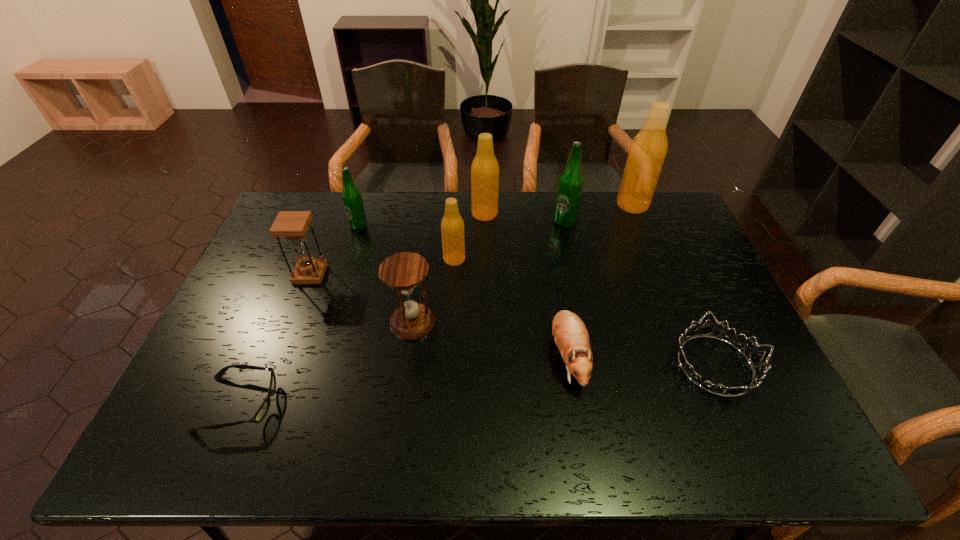
Find the location of a particular element. The width and height of the screenshot is (960, 540). vacant space at the far left corner is located at coordinates pos(306,199).

This screenshot has width=960, height=540. Identify the location of free area in between the third object from left to right and the hamster. (463, 291).

This screenshot has width=960, height=540. I want to click on empty location between the nearest tan beer bottle and the eighth tallest object, so click(511, 308).

Identify the location of vacant area that lies between the right green beer bottle and the tiara. (639, 293).

Identify the location of free space between the third shortest object and the fourth object from left to right. This screenshot has height=540, width=960. (491, 339).

Where is `free spot between the second tan beer bottle from left to right and the second beer bottle from right to left`? The image size is (960, 540). free spot between the second tan beer bottle from left to right and the second beer bottle from right to left is located at coordinates (524, 218).

The height and width of the screenshot is (540, 960). Find the location of `free space between the shortest object and the rightmost tan beer bottle`. free space between the shortest object and the rightmost tan beer bottle is located at coordinates (436, 304).

The height and width of the screenshot is (540, 960). Identify the location of empty space that is in between the brown hamster and the farther hourglass. (439, 315).

You are a GUI agent. You are given a task and a screenshot of the screen. Output one action in this format:
    pyautogui.click(x=<x>, y=<y>)
    Task: Click on the blank region between the rightmost beer bottle and the shortest object
    
    Given the screenshot: What is the action you would take?
    pyautogui.click(x=436, y=304)

This screenshot has height=540, width=960. In order to click on free point between the right hourglass and the sixth object from right to left in this screenshot , I will do `click(434, 291)`.